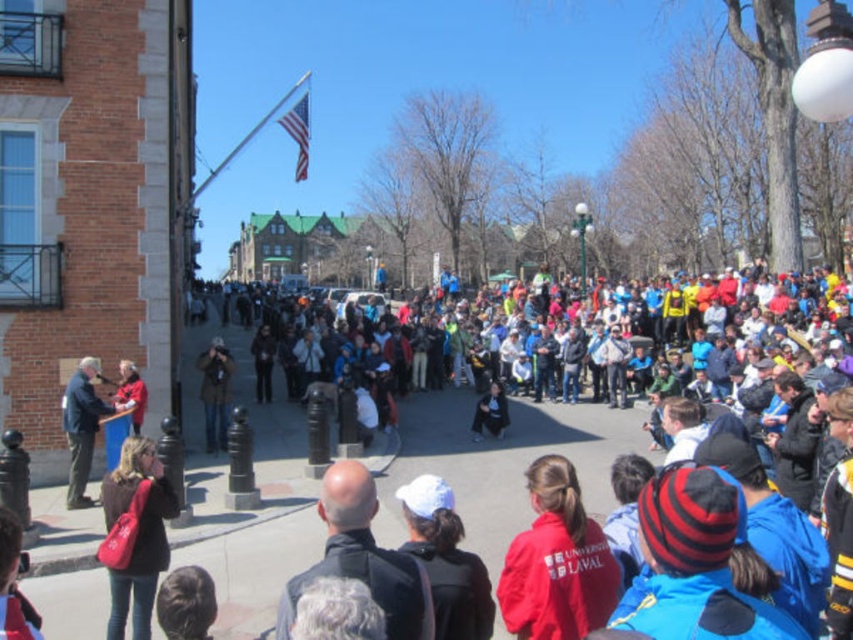
Can you confirm if red fleece jacket at center is bigger than dark blue jacket at left?

No, red fleece jacket at center is not bigger than dark blue jacket at left.

Can you confirm if red fleece jacket at center is positioned to the right of dark blue jacket at left?

Correct, you'll find red fleece jacket at center to the right of dark blue jacket at left.

Which is in front, point (560, 499) or point (82, 392)?

Point (560, 499) is more forward.

I want to click on red fleece jacket at center, so click(x=556, y=561).

Who is higher up, matte brown jacket at lower left or dark blue jacket at left?

dark blue jacket at left

Does matte brown jacket at lower left appear under dark blue jacket at left?

Yes, matte brown jacket at lower left is below dark blue jacket at left.

Who is more forward, (144, 513) or (68, 394)?

Point (144, 513) is more forward.

This screenshot has width=853, height=640. In order to click on matte brown jacket at lower left in this screenshot , I will do (x=137, y=534).

Identify the location of red fleece jacket at center. (556, 561).

Is point (540, 493) farther from camera compared to point (112, 596)?

No, it is in front of (112, 596).

Locate an element on the screen. This screenshot has height=640, width=853. red fleece jacket at center is located at coordinates (556, 561).